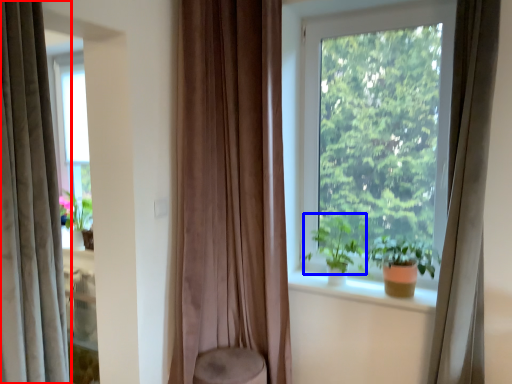
Question: Which object is further to the camera taking this photo, curtain (highlighted by a red box) or vegetation (highlighted by a blue box)?

Choices:
 (A) curtain
 (B) vegetation

Answer: (B)